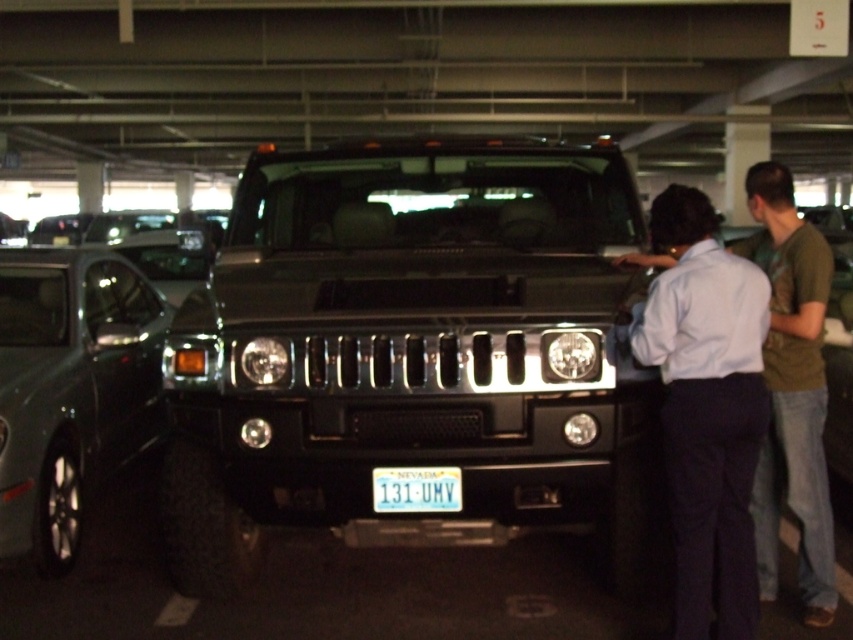
From the picture: You are standing in the parking garage and see the shiny black suv at center and the light blue shirt at center. Which object is positioned to the left from your perspective?

The shiny black suv at center is to the left of the light blue shirt at center.

You are a security guard in the parking garage. You need to check if the distance between the satin silver car at left and the light blue shirt at center is within the 4 meter safety zone. Is it within the zone?

The satin silver car at left is 3.99 meters from the light blue shirt at center, so it is within the 4 meter safety zone.

You are standing at the entrance of the parking garage and see two points marked in the scene. Which point is closer to you, point (33, 410) or point (705, 608)?

Point (33, 410) is further to the camera than point (705, 608), so the closer point to you is point (705, 608).